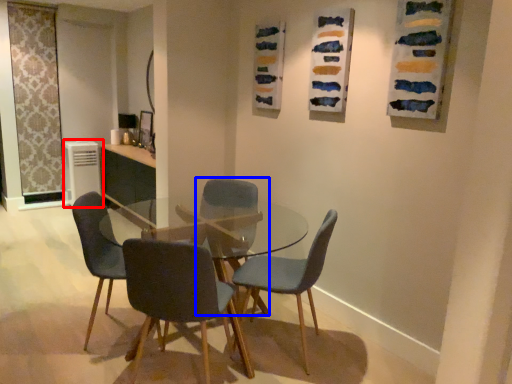
Question: Among these objects, which one is nearest to the camera, appliance (highlighted by a red box) or chair (highlighted by a blue box)?

Choices:
 (A) appliance
 (B) chair

Answer: (B)